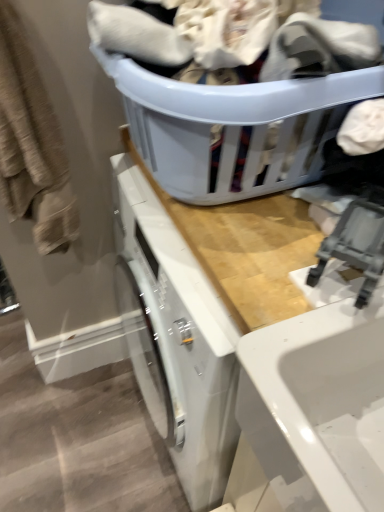
Question: Should I look upward or downward to see matte plastic laundry basket at upper center?

Choices:
 (A) up
 (B) down

Answer: (A)

Question: Is beige textured towel at left far from matte plastic laundry basket at upper center?

Choices:
 (A) yes
 (B) no

Answer: (B)

Question: Is matte plastic laundry basket at upper center inside beige textured towel at left?

Choices:
 (A) yes
 (B) no

Answer: (B)

Question: Is the depth of beige textured towel at left less than that of matte plastic laundry basket at upper center?

Choices:
 (A) yes
 (B) no

Answer: (B)

Question: Is beige textured towel at left outside of matte plastic laundry basket at upper center?

Choices:
 (A) yes
 (B) no

Answer: (A)

Question: Does beige textured towel at left appear on the left side of matte plastic laundry basket at upper center?

Choices:
 (A) no
 (B) yes

Answer: (B)

Question: Is matte plastic laundry basket at upper center at the back of beige textured towel at left?

Choices:
 (A) yes
 (B) no

Answer: (B)

Question: Is wooden counter at upper center not near beige textured towel at left?

Choices:
 (A) no
 (B) yes

Answer: (A)

Question: Does wooden counter at upper center come in front of beige textured towel at left?

Choices:
 (A) no
 (B) yes

Answer: (B)

Question: Is wooden counter at upper center at the left side of beige textured towel at left?

Choices:
 (A) yes
 (B) no

Answer: (B)

Question: From a real-world perspective, is wooden counter at upper center physically above beige textured towel at left?

Choices:
 (A) no
 (B) yes

Answer: (A)

Question: Considering the relative sizes of wooden counter at upper center and beige textured towel at left in the image provided, is wooden counter at upper center thinner than beige textured towel at left?

Choices:
 (A) yes
 (B) no

Answer: (B)

Question: Considering the relative sizes of wooden counter at upper center and beige textured towel at left in the image provided, is wooden counter at upper center bigger than beige textured towel at left?

Choices:
 (A) no
 (B) yes

Answer: (B)

Question: Is the depth of beige textured towel at left less than that of wooden counter at upper center?

Choices:
 (A) no
 (B) yes

Answer: (A)